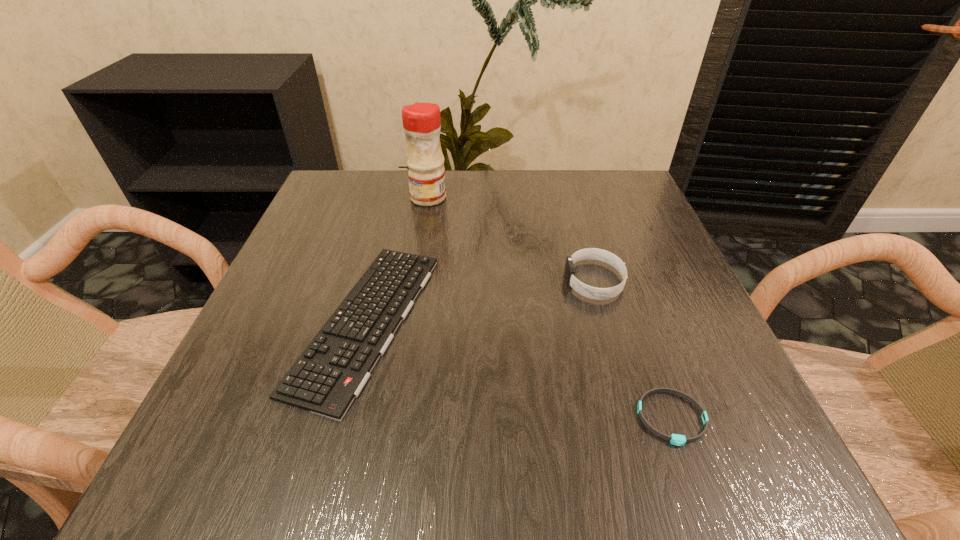
You are a GUI agent. You are given a task and a screenshot of the screen. Output one action in this format:
    pyautogui.click(x=<x>, y=<y>)
    Task: Click on the free space at the far left corner of the desktop
    The height and width of the screenshot is (540, 960).
    Given the screenshot: What is the action you would take?
    tap(343, 171)

Image resolution: width=960 pixels, height=540 pixels. In order to click on free space at the far right corner of the desktop in this screenshot , I will do `click(618, 204)`.

In order to click on vacant space in between the shorter wristband and the second shortest object in this screenshot , I will do `click(518, 369)`.

At what (x,y) coordinates should I click in order to perform the action: click on empty space that is in between the condiment and the second tallest object. Please return your answer as a coordinate pair (x, y). The height and width of the screenshot is (540, 960). Looking at the image, I should click on tap(512, 239).

I want to click on vacant area that lies between the farthest object and the shorter wristband, so click(550, 308).

The image size is (960, 540). I want to click on vacant area that lies between the taller wristband and the shortest object, so click(x=633, y=349).

The height and width of the screenshot is (540, 960). I want to click on free space between the nearer wristband and the tallest object, so click(550, 308).

Locate an element on the screen. The width and height of the screenshot is (960, 540). vacant region between the farther wristband and the condiment is located at coordinates [x=512, y=239].

The width and height of the screenshot is (960, 540). Find the location of `free point between the shorter wristband and the condiment`. free point between the shorter wristband and the condiment is located at coordinates (550, 308).

Find the location of a particular element. The height and width of the screenshot is (540, 960). empty space between the computer keyboard and the third shortest object is located at coordinates (480, 301).